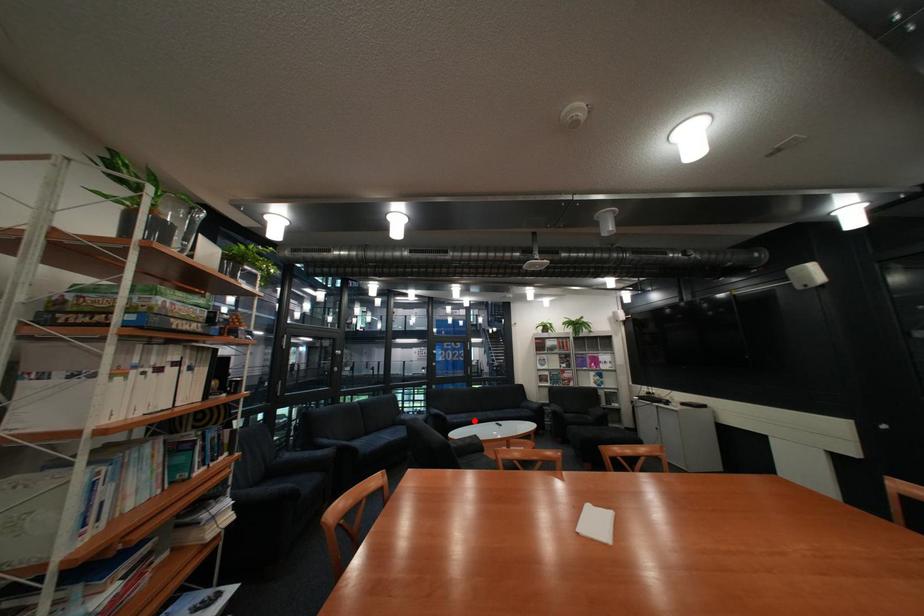
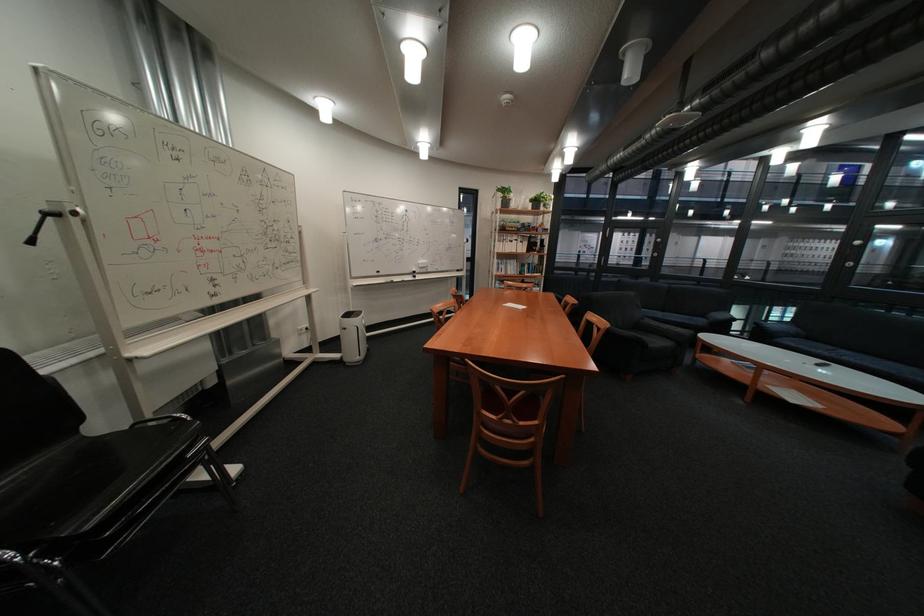
Question: A red point is marked in image1. In image2, is the corresponding 3D point closer to the camera or farther? Reply with the corresponding letter.

Choices:
 (A) The corresponding 3D point is closer.
 (B) The corresponding 3D point is farther.

Answer: (A)